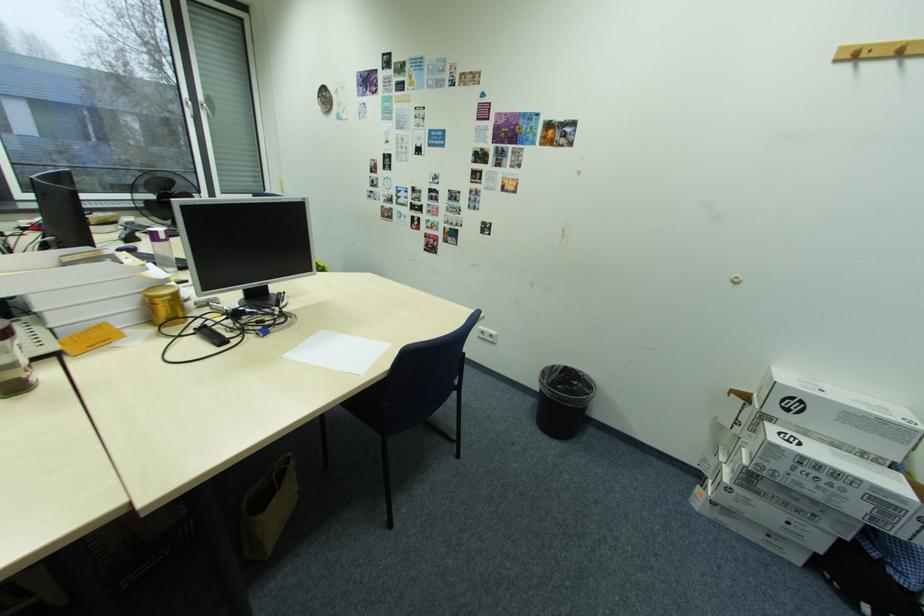
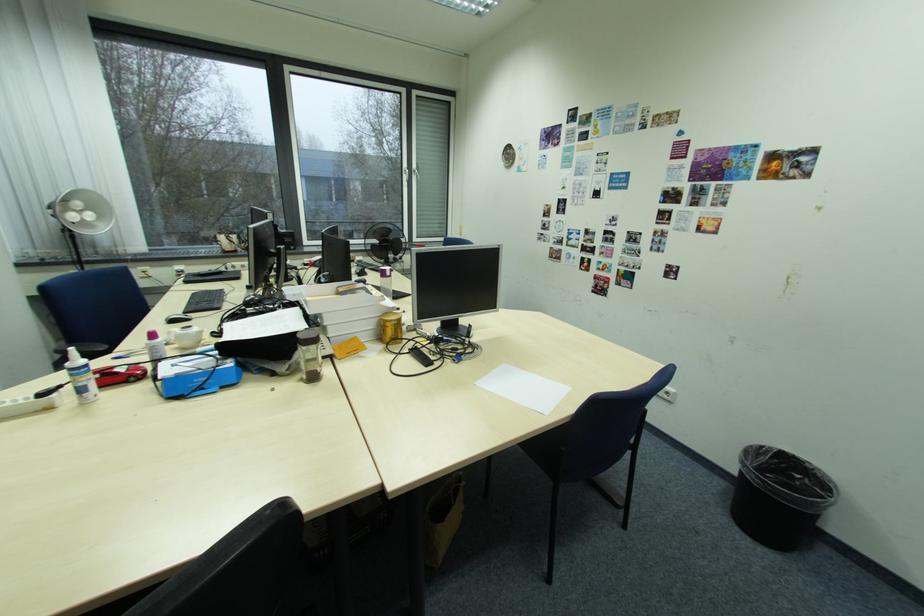
The point at (290, 357) is marked in the first image. Where is the corresponding point in the second image?

(482, 384)